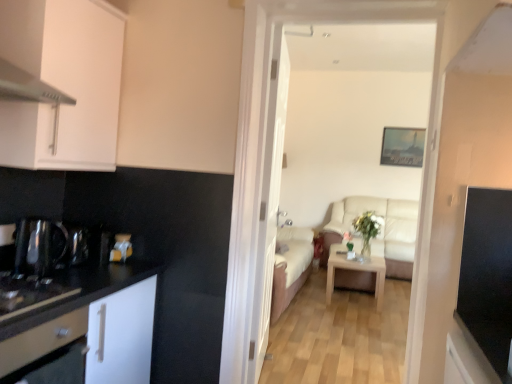
Question: Is point (83, 336) closer or farther from the camera than point (253, 284)?

Choices:
 (A) farther
 (B) closer

Answer: (B)

Question: Looking at the image, does black matte dishwasher at lower left seem bigger or smaller compared to white wooden door at center?

Choices:
 (A) big
 (B) small

Answer: (B)

Question: Which is farther from the beige fabric sofa at center?

Choices:
 (A) shiny metallic kettle at left, the 1th appliance when ordered from left to right
 (B) beige leather couch at center
 (C) white glossy drawer at left
 (D) light wood/texture coffee table at center
 (E) white matte cabinet at left, the second cabinetry from the top

Answer: (C)

Question: Which object is positioned farthest from the black glossy tv at right, which ranks as the first appliance in right-to-left order?

Choices:
 (A) white wooden door at center
 (B) black matte dishwasher at lower left
 (C) beige leather couch at center
 (D) beige fabric sofa at center
 (E) light wood/texture coffee table at center

Answer: (D)